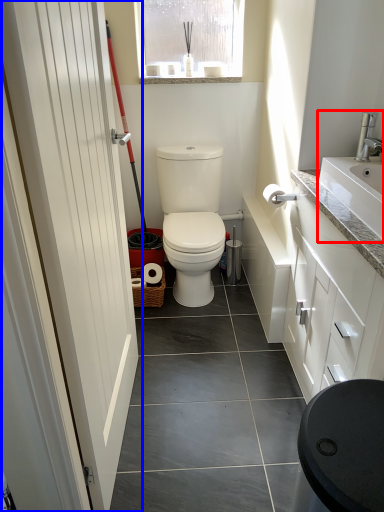
Question: Which of the following is the farthest to the observer, sink (highlighted by a red box) or door (highlighted by a blue box)?

Choices:
 (A) sink
 (B) door

Answer: (A)